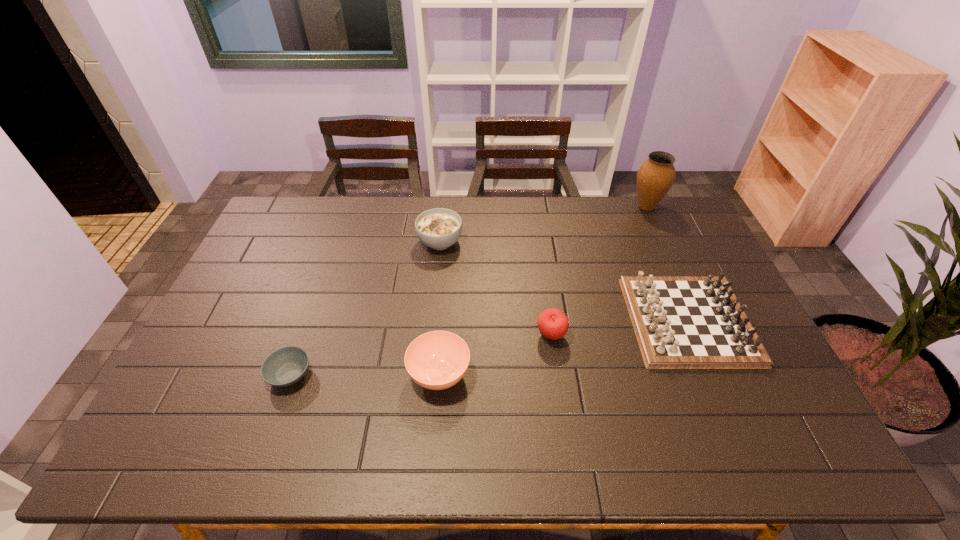
The width and height of the screenshot is (960, 540). Find the location of `chessboard that is at the right edge`. chessboard that is at the right edge is located at coordinates (681, 322).

Identify the location of object that is at the far right corner. This screenshot has width=960, height=540. (x=656, y=175).

Locate an element on the screen. This screenshot has width=960, height=540. vacant space at the far edge of the desktop is located at coordinates (538, 200).

This screenshot has width=960, height=540. In the image, there is a desktop. Find the location of `vacant area at the near edge`. vacant area at the near edge is located at coordinates (521, 430).

Locate an element on the screen. free spot at the left edge of the desktop is located at coordinates (247, 274).

This screenshot has width=960, height=540. In the image, there is a desktop. Find the location of `vacant space at the right edge`. vacant space at the right edge is located at coordinates (740, 413).

Identify the location of vacant space at the far left corner. This screenshot has width=960, height=540. (274, 219).

Where is `free space that is in between the farthest soup bowl and the second shortest soup bowl`? free space that is in between the farthest soup bowl and the second shortest soup bowl is located at coordinates (440, 308).

Where is `free spot between the apple and the tallest object`? The image size is (960, 540). free spot between the apple and the tallest object is located at coordinates (599, 271).

I want to click on free area in between the second tallest soup bowl and the chessboard, so click(x=564, y=347).